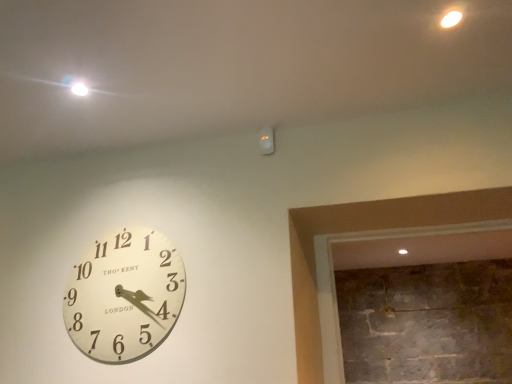
Measure the distance between white wooden clock at left and camera.

4.95 feet.

What is the approximate width of white wooden clock at left?

white wooden clock at left is 1.93 inches in width.

Based on the photo, what is the approximate height of white wooden clock at left?

white wooden clock at left is 51.96 centimeters in height.

The image size is (512, 384). What do you see at coordinates (124, 296) in the screenshot?
I see `white wooden clock at left` at bounding box center [124, 296].

The image size is (512, 384). I want to click on white wooden clock at left, so click(124, 296).

Find the location of a particular element. Image resolution: width=512 pixels, height=384 pixels. white wooden clock at left is located at coordinates (124, 296).